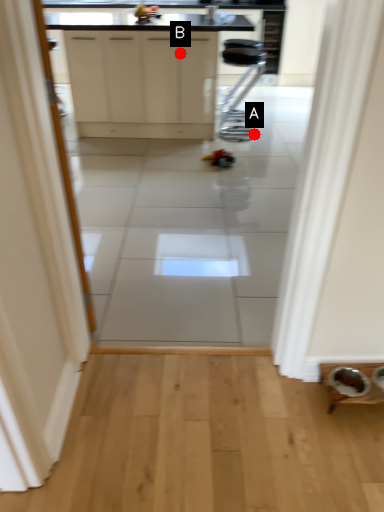
Question: Two points are circled on the image, labeled by A and B beside each circle. Which point is farther to the camera?

Choices:
 (A) A is further
 (B) B is further

Answer: (A)